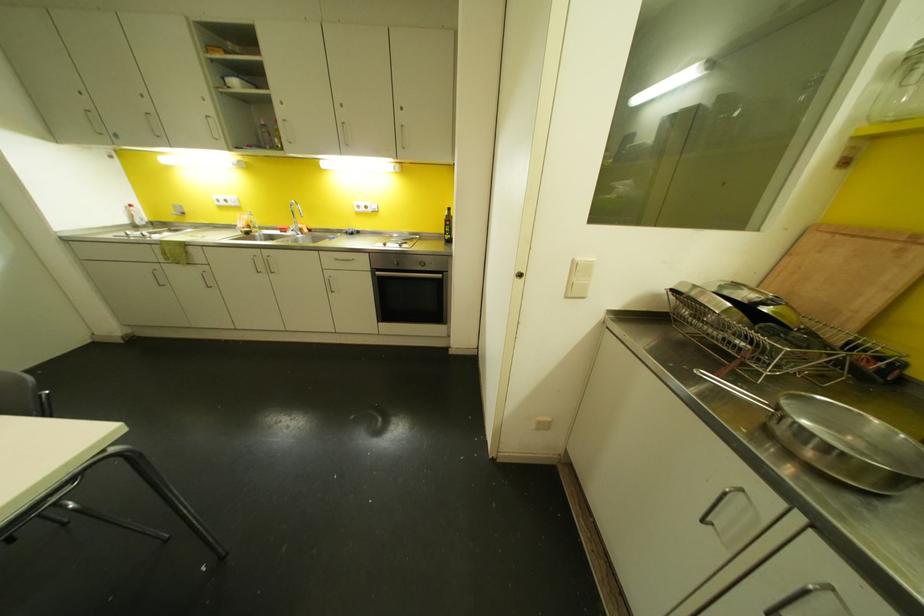
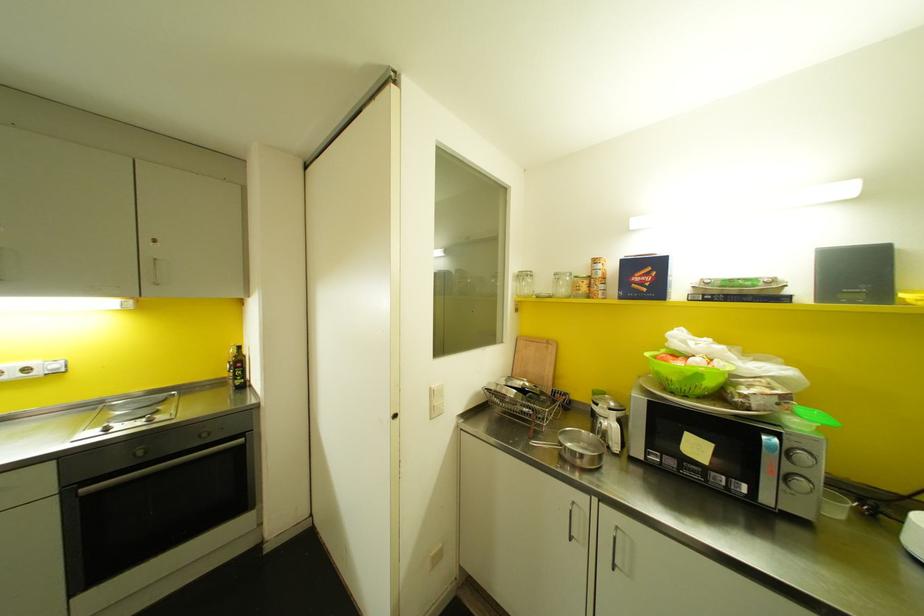
Find the pixel in the second image that matches point 830,588 in the first image.

(616, 527)